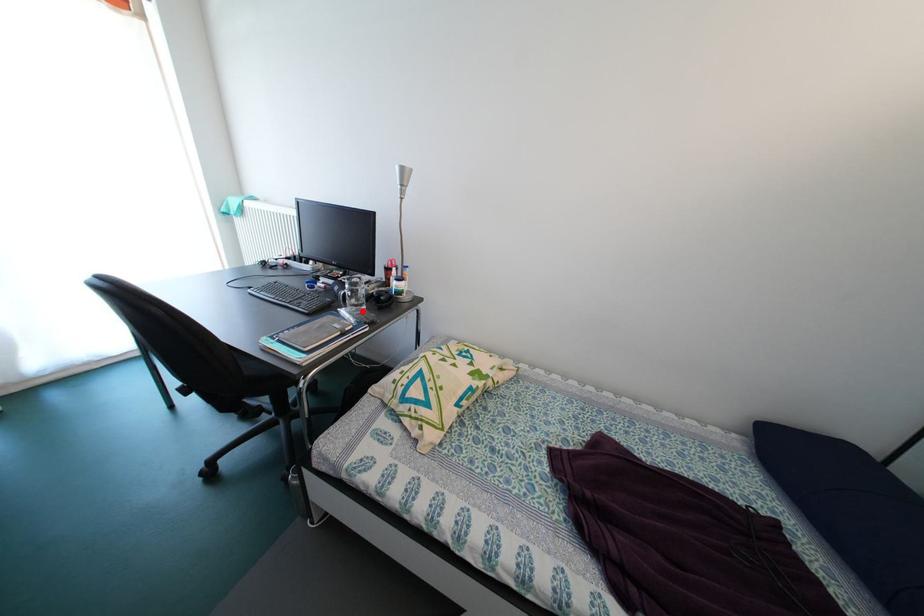
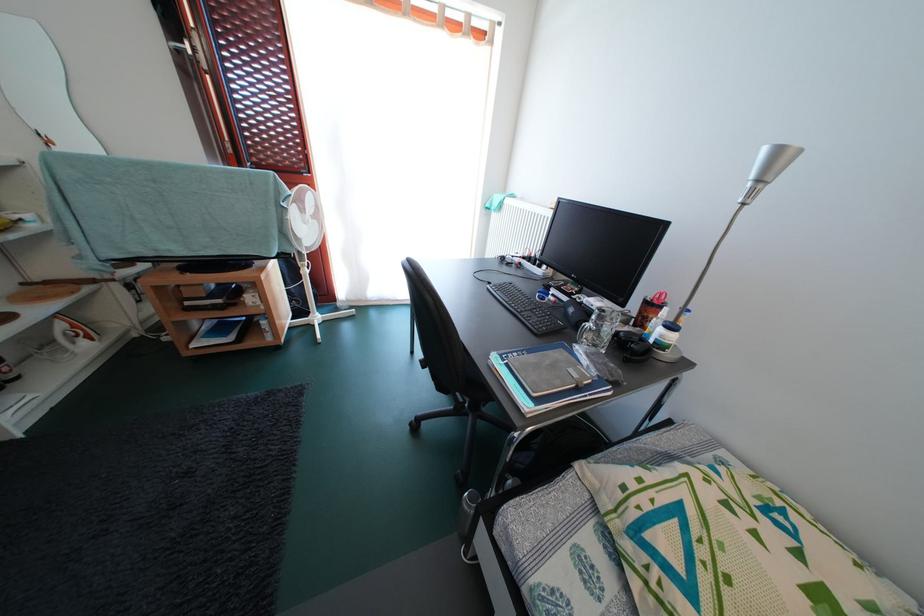
Locate, in the second image, the point that corresponds to the highlighted location in the first image.

(602, 351)